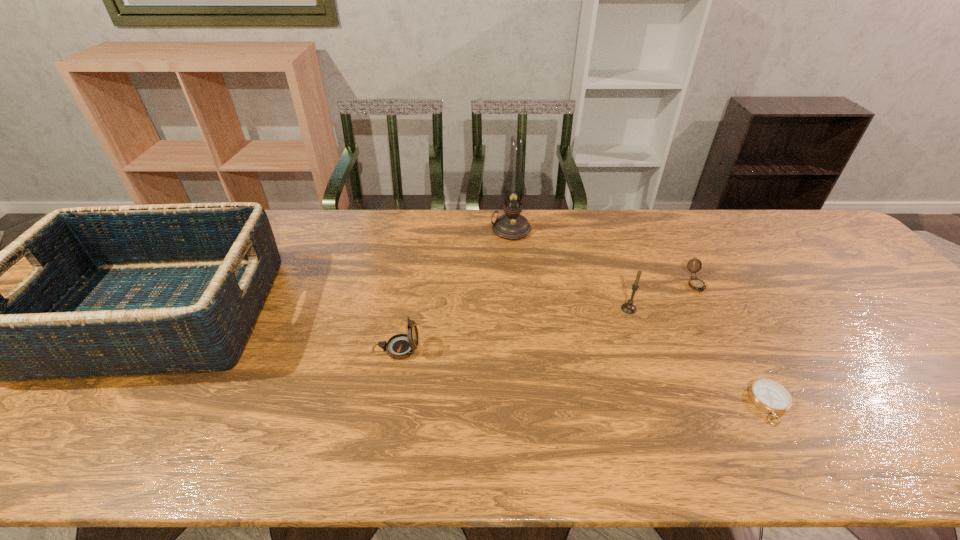
The height and width of the screenshot is (540, 960). I want to click on free point located on the front of the fourth object from right to left, so click(x=517, y=301).

At what (x,y) coordinates should I click in order to perform the action: click on free space located 0.210m on the back of the candle. Please return your answer as a coordinate pair (x, y). The height and width of the screenshot is (540, 960). Looking at the image, I should click on (610, 255).

The height and width of the screenshot is (540, 960). I want to click on free space located on the face of the second farthest compass, so [511, 349].

The width and height of the screenshot is (960, 540). What are the coordinates of `free point located on the face of the farthest compass` in the screenshot? It's located at (749, 382).

You are a GUI agent. You are given a task and a screenshot of the screen. Output one action in this format:
    pyautogui.click(x=<x>, y=<y>)
    Task: Click on the vacant position located 0.070m on the right of the shortest compass
    Image resolution: width=960 pixels, height=540 pixels.
    Given the screenshot: What is the action you would take?
    pyautogui.click(x=823, y=404)

In order to click on object located in the far edge section of the desktop in this screenshot , I will do `click(510, 226)`.

Find the location of `object located at the near edge`. object located at the near edge is located at coordinates (770, 396).

This screenshot has height=540, width=960. Identify the location of vacant region at the far edge. point(535,248).

This screenshot has width=960, height=540. Find the location of `blank space at the near edge`. blank space at the near edge is located at coordinates (346, 431).

This screenshot has height=540, width=960. What are the coordinates of `free space at the right edge of the desktop` in the screenshot? It's located at (841, 291).